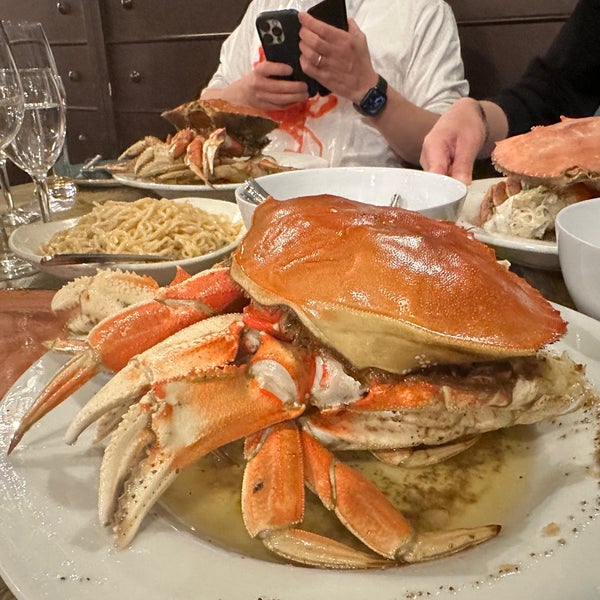
I want to click on 2 glasses of water, so click(53, 138), click(6, 126).